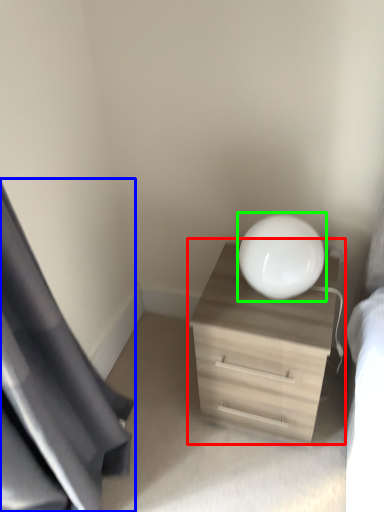
Question: Which object is positioned closest to dresser (highlighted by a red box)? Select from curtain (highlighted by a blue box) and round table (highlighted by a green box).

Choices:
 (A) curtain
 (B) round table

Answer: (B)